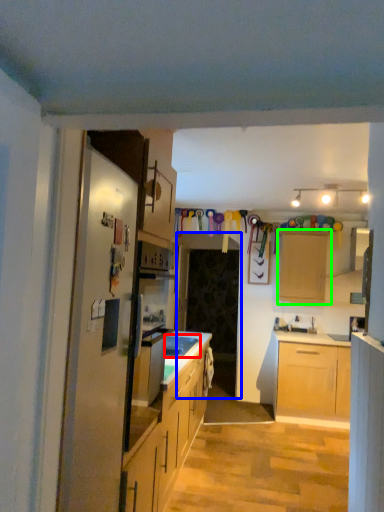
Question: Which object is positioned closest to sink (highlighted by a red box)? Select from glass door (highlighted by a blue box) and cabinetry (highlighted by a green box).

Choices:
 (A) glass door
 (B) cabinetry

Answer: (A)